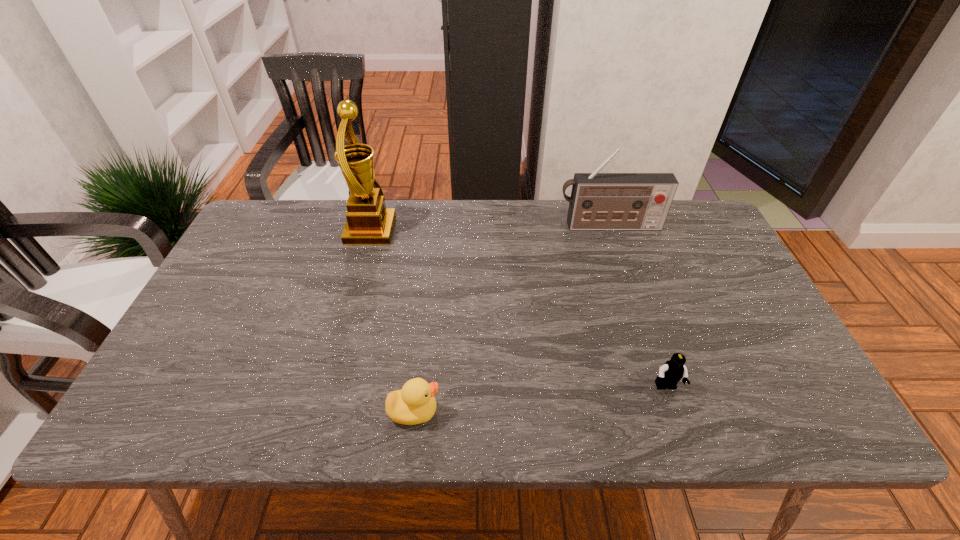
I want to click on free space between the second object from left to right and the third shortest object, so click(512, 319).

The width and height of the screenshot is (960, 540). Find the location of `vacant area between the Lego and the second object from left to right`. vacant area between the Lego and the second object from left to right is located at coordinates (540, 400).

At what (x,y) coordinates should I click in order to perform the action: click on vacant area that lies between the Lego and the third object from right to left. Please return your answer as a coordinate pair (x, y). The image size is (960, 540). Looking at the image, I should click on (540, 400).

Locate an element on the screen. The height and width of the screenshot is (540, 960). free area in between the duck and the leftmost object is located at coordinates (393, 321).

In order to click on free space between the third shortest object and the second object from left to right in this screenshot , I will do `click(512, 319)`.

Identify the location of free area in between the leftmost object and the duck. (393, 321).

In order to click on vacant point located between the Lego and the tallest object in this screenshot , I will do `click(518, 309)`.

Identify the location of empty space that is in between the award and the Lego. The width and height of the screenshot is (960, 540). (518, 309).

Locate an element on the screen. The width and height of the screenshot is (960, 540). free point between the radio receiver and the duck is located at coordinates (512, 319).

Choose which object is the nearest neighbor to the Lego. Please provide its 2D coordinates. Your answer should be formatted as a tuple, i.e. [(x, y)], where the tuple contains the x and y coordinates of a point satisfying the conditions above.

[(415, 403)]